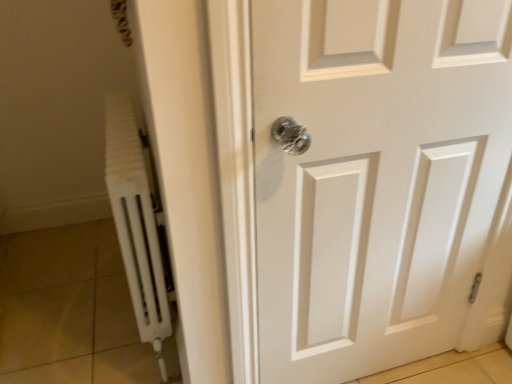
Question: Is point (396, 205) positioned closer to the camera than point (120, 132)?

Choices:
 (A) farther
 (B) closer

Answer: (B)

Question: Considering the relative positions of white matte door at center and white matte radiator at left in the image provided, is white matte door at center to the left or to the right of white matte radiator at left?

Choices:
 (A) right
 (B) left

Answer: (A)

Question: From the image's perspective, is white matte door at center located above or below white matte radiator at left?

Choices:
 (A) below
 (B) above

Answer: (A)

Question: Choose the correct answer: Is white matte radiator at left inside white matte door at center or outside it?

Choices:
 (A) outside
 (B) inside

Answer: (A)

Question: Is point (142, 246) closer or farther from the camera than point (312, 266)?

Choices:
 (A) closer
 (B) farther

Answer: (B)

Question: Considering the relative positions of white matte radiator at left and white matte door at center in the image provided, is white matte radiator at left to the left or to the right of white matte door at center?

Choices:
 (A) right
 (B) left

Answer: (B)

Question: From the image's perspective, is white matte radiator at left above or below white matte door at center?

Choices:
 (A) below
 (B) above

Answer: (B)